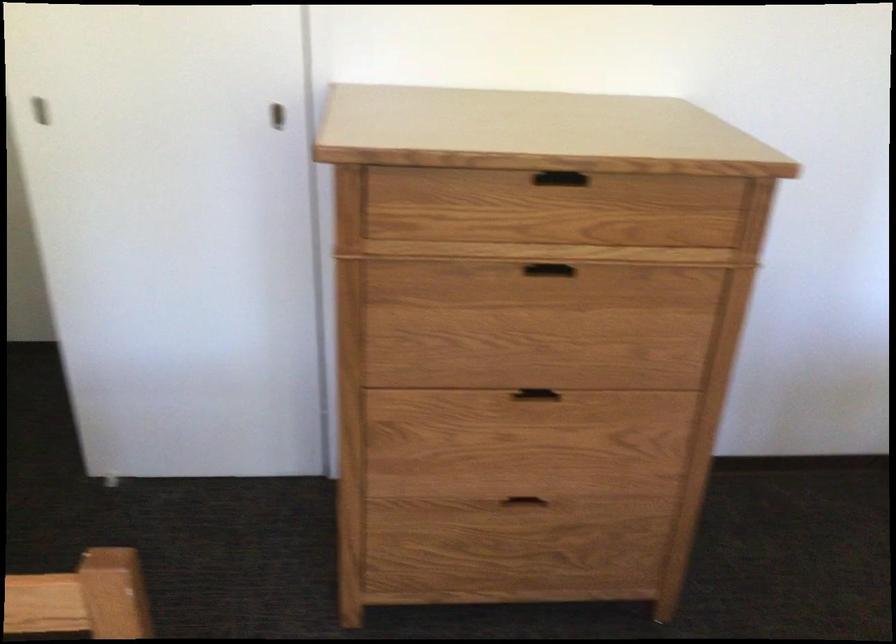
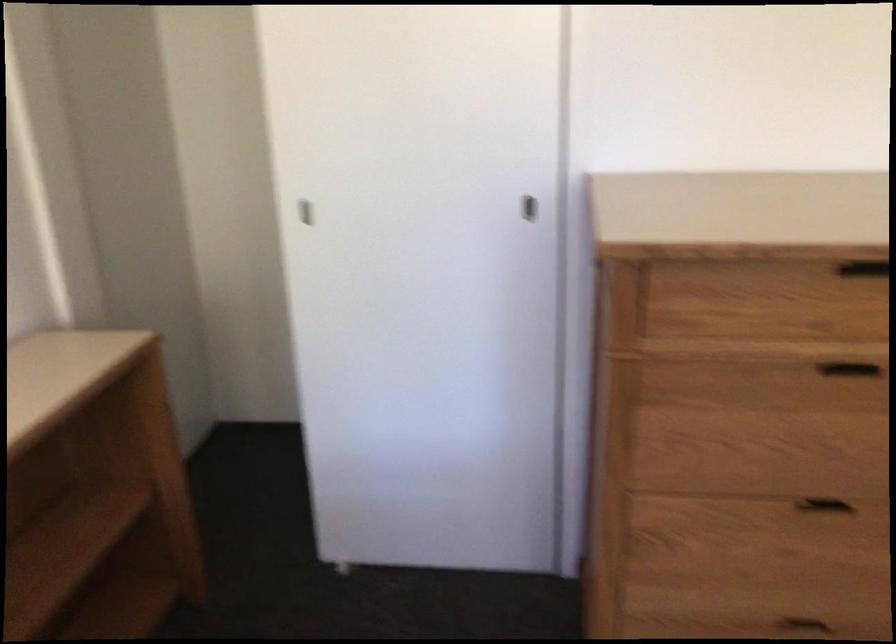
Question: The images are taken continuously from a first-person perspective. In which direction are you moving?

Choices:
 (A) Left
 (B) Right
 (C) Forward
 (D) Backward

Answer: (A)